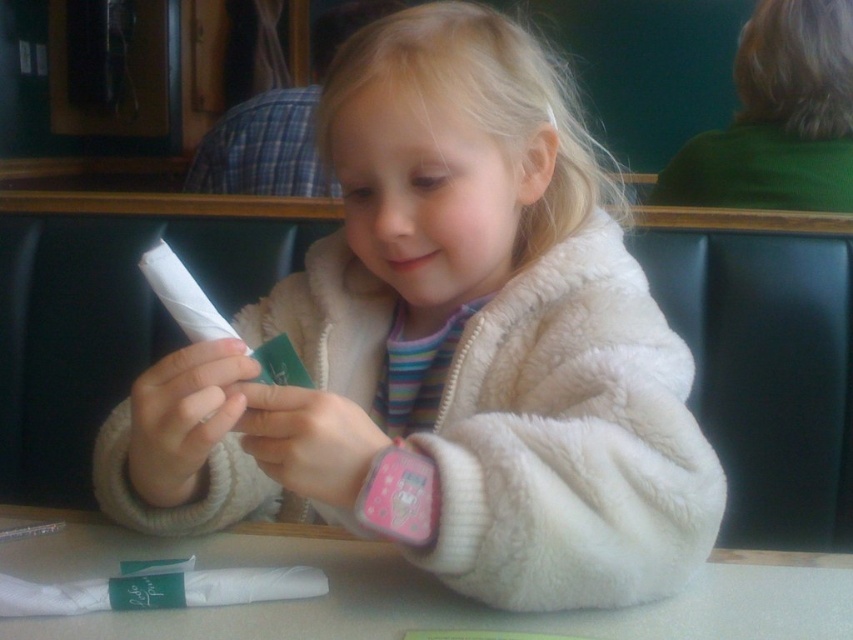
Which is more to the right, white fluffy coat at center or white matte table at center?

Positioned to the right is white fluffy coat at center.

Is white fluffy coat at center bigger than white matte table at center?

Yes.

At what (x,y) coordinates should I click in order to perform the action: click on white fluffy coat at center. Please return your answer as a coordinate pair (x, y). This screenshot has height=640, width=853. Looking at the image, I should click on (447, 348).